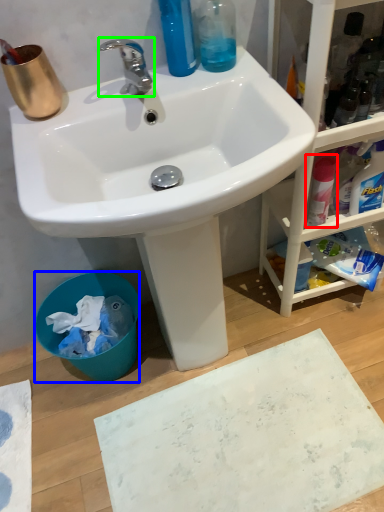
Question: Which object is the closest to the cleaning product (highlighted by a red box)? Choose among these: trash bin/can (highlighted by a blue box) or tap (highlighted by a green box).

Choices:
 (A) trash bin/can
 (B) tap

Answer: (B)